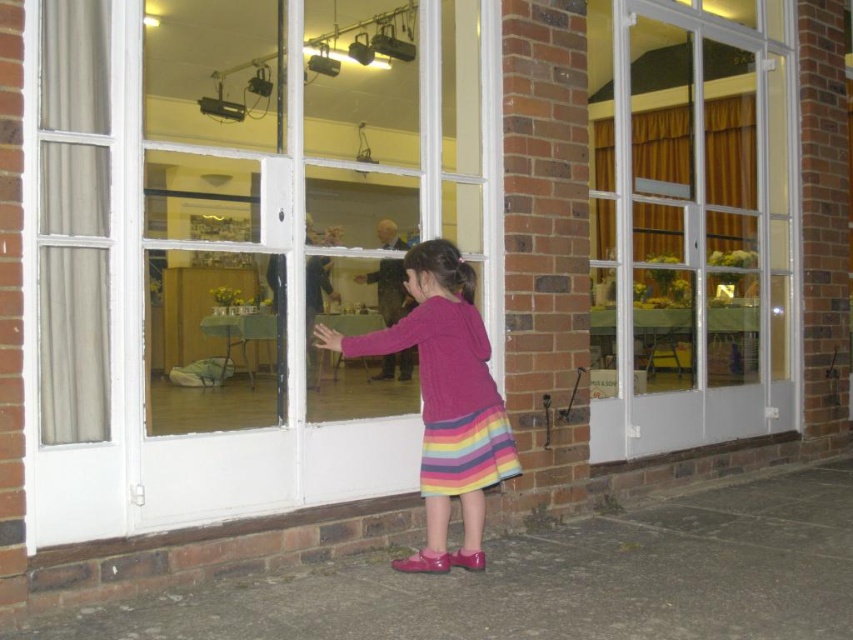
Is transparent glass door at center positioned behind knitted pink sweater at center?

No.

Does transparent glass door at center appear on the right side of knitted pink sweater at center?

Incorrect, transparent glass door at center is not on the right side of knitted pink sweater at center.

Is point (103, 179) farther from camera compared to point (370, 337)?

No, (103, 179) is in front of (370, 337).

Identify the location of transparent glass door at center. The height and width of the screenshot is (640, 853). (245, 252).

Is transparent glass door at center behind clear glass door at center?

That is False.

Can you confirm if transparent glass door at center is bigger than clear glass door at center?

Incorrect, transparent glass door at center is not larger than clear glass door at center.

Does point (352, 211) come in front of point (714, 65)?

Yes, point (352, 211) is closer to viewer.

This screenshot has width=853, height=640. I want to click on transparent glass door at center, so click(245, 252).

Is clear glass door at center shorter than knitted pink sweater at center?

In fact, clear glass door at center may be taller than knitted pink sweater at center.

Who is more distant from viewer, (x=741, y=49) or (x=318, y=346)?

The point (x=741, y=49) is more distant.

Is point (633, 148) positioned behind point (434, 536)?

Yes, point (633, 148) is farther from viewer.

You are a GUI agent. You are given a task and a screenshot of the screen. Output one action in this format:
    pyautogui.click(x=<x>, y=<y>)
    Task: Click on the clear glass door at center
    This screenshot has height=640, width=853.
    Given the screenshot: What is the action you would take?
    pyautogui.click(x=689, y=225)